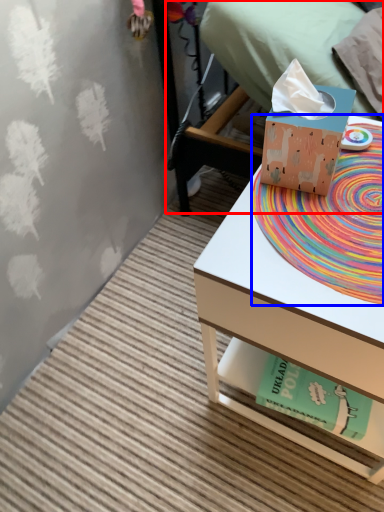
Question: Among these objects, which one is farthest to the camera, bed (highlighted by a red box) or mat (highlighted by a blue box)?

Choices:
 (A) bed
 (B) mat

Answer: (A)